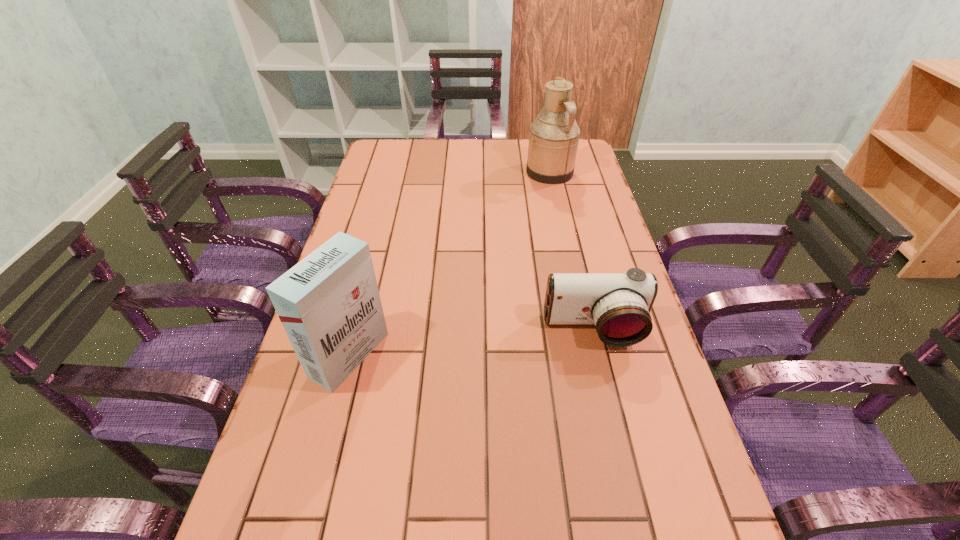
This screenshot has height=540, width=960. I want to click on the tallest object, so click(x=554, y=134).

Identify the location of pitcher. The image size is (960, 540). (554, 134).

Where is `the leftmost object`? the leftmost object is located at coordinates (329, 304).

Where is `cigarette case`? cigarette case is located at coordinates (329, 304).

The width and height of the screenshot is (960, 540). In order to click on the shortest object in this screenshot , I will do `click(619, 304)`.

Image resolution: width=960 pixels, height=540 pixels. Identify the location of free space located on the front of the tallest object. (569, 261).

Locate an element on the screen. The width and height of the screenshot is (960, 540). vacant space situated on the right of the leftmost object is located at coordinates (438, 355).

You are a GUI agent. You are given a task and a screenshot of the screen. Output one action in this format:
    pyautogui.click(x=<x>, y=<y>)
    Task: Click on the vacant space located 0.050m on the surface of the camcorder
    Image resolution: width=960 pixels, height=540 pixels.
    Given the screenshot: What is the action you would take?
    pyautogui.click(x=604, y=370)

In order to click on object at the far edge in this screenshot , I will do `click(554, 134)`.

Identify the location of object present at the left edge. (329, 304).